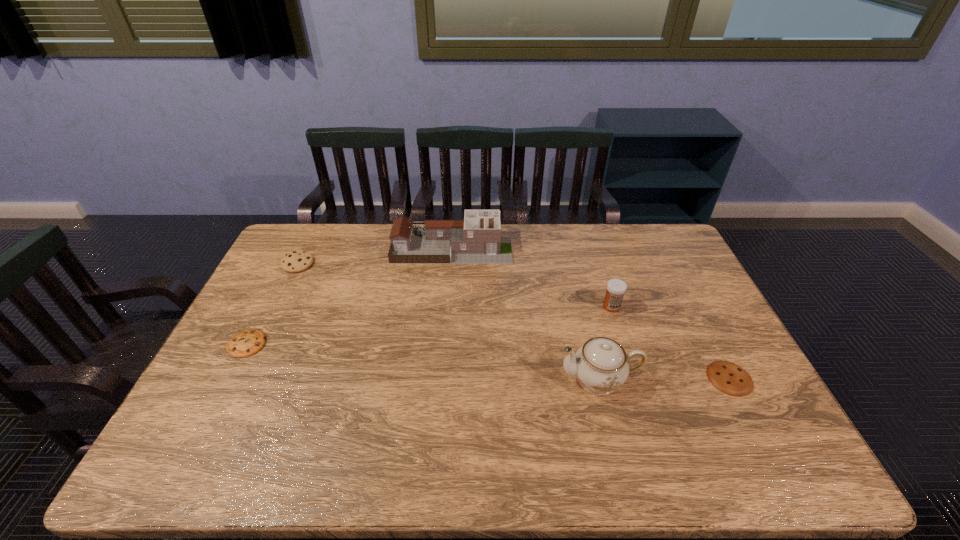
Locate an element on the screen. The width and height of the screenshot is (960, 540). the fourth object from right to left is located at coordinates (477, 239).

Identify the location of chinaware. The height and width of the screenshot is (540, 960). (601, 365).

Where is `the fourth nearest object`? the fourth nearest object is located at coordinates (616, 288).

Locate an element on the screen. The image size is (960, 540). medicine is located at coordinates (616, 288).

You are a GUI agent. You are given a task and a screenshot of the screen. Output one action in this format:
    pyautogui.click(x=<x>, y=<y>)
    Task: Click on the third shortest object
    
    Given the screenshot: What is the action you would take?
    pyautogui.click(x=297, y=261)

I want to click on the tallest cookie, so click(x=297, y=261).

In order to click on the third nearest object in this screenshot , I will do `click(248, 342)`.

Where is `the rightmost cookie`? the rightmost cookie is located at coordinates (731, 379).

This screenshot has width=960, height=540. Identify the location of the rightmost object. (731, 379).

Where is `free spot located 0.060m at the main entrance of the dollhouse`? The width and height of the screenshot is (960, 540). free spot located 0.060m at the main entrance of the dollhouse is located at coordinates (528, 248).